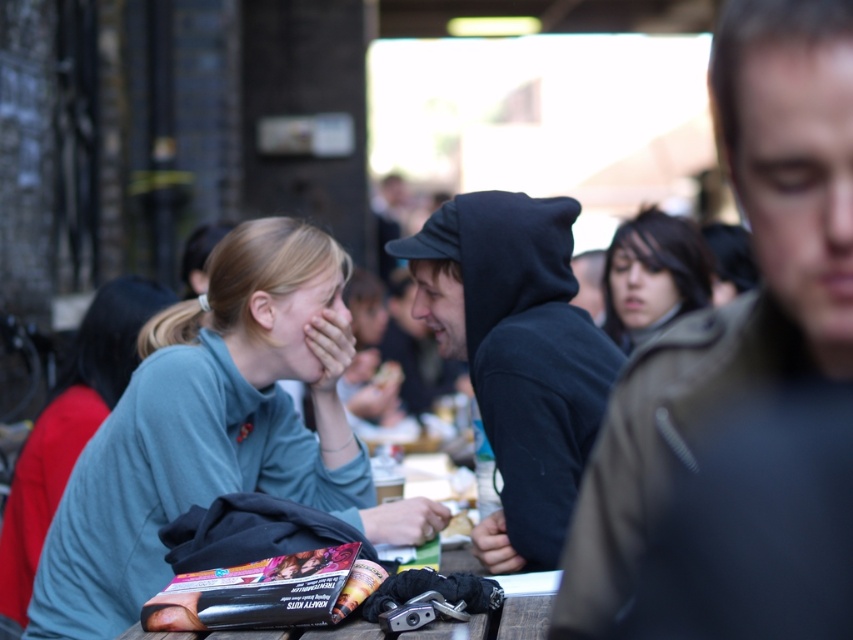
You are a photographer trying to capture a candid shot of the woman with dark brown hair at center without her noticing. The dark brown leather jacket at right is blocking your view. Can you move the jacket to get a clear shot?

The dark brown leather jacket at right is in front of dark brown hair at center, so moving the jacket would allow you to see the woman with dark brown hair at center clearly.

You are a photographer standing at the camera position in the scene. You want to take a photo of the matte green sweater at center. Is the sweater within your camera range of 5 meters?

The matte green sweater at center is 6.21 meters away from the camera, so it is beyond the 5 meters range. The sweater cannot be captured in the photo.